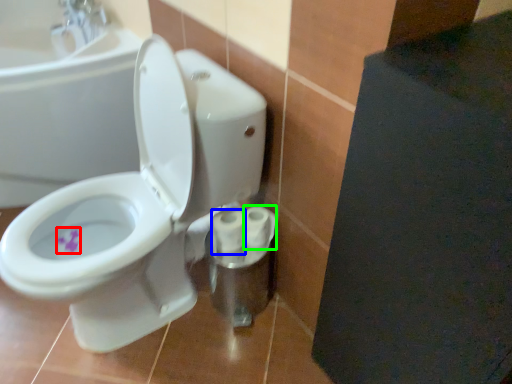
Question: Which is farther away from flower (highlighted by a red box)? toilet paper (highlighted by a blue box) or toilet paper (highlighted by a green box)?

Choices:
 (A) toilet paper
 (B) toilet paper

Answer: (B)